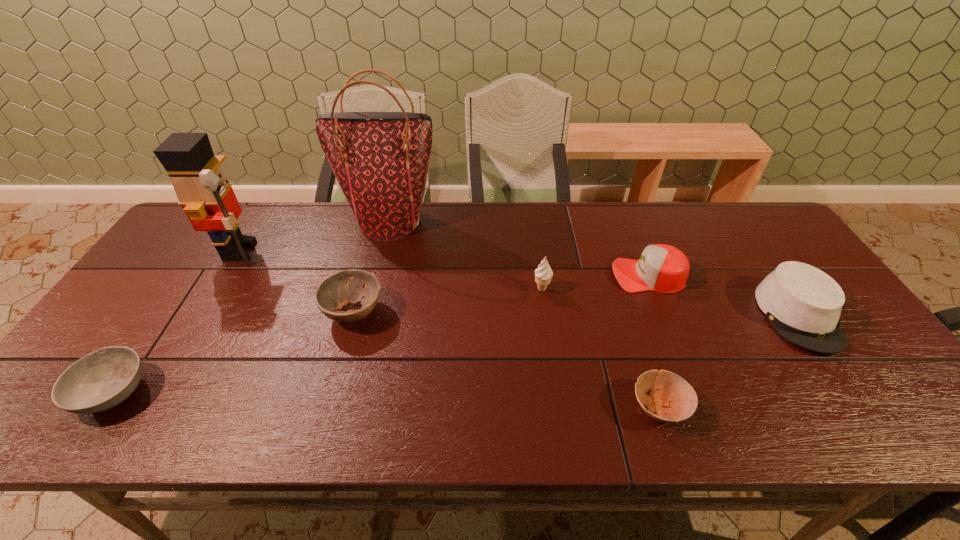
You are a GUI agent. You are given a task and a screenshot of the screen. Output one action in this format:
    pyautogui.click(x=<x>, y=<y>)
    Task: Click on the tallest object
    The height and width of the screenshot is (540, 960).
    Given the screenshot: What is the action you would take?
    [380, 160]

I want to click on nutcracker, so click(x=204, y=192).

Find the location of a particular element. This screenshot has height=540, width=960. the sixth shortest object is located at coordinates (543, 274).

Locate an element on the screen. This screenshot has width=960, height=540. the fourth object from right to left is located at coordinates (543, 274).

You are a GUI agent. You are given a task and a screenshot of the screen. Output one action in this format:
    pyautogui.click(x=<x>, y=<y>)
    Task: Click on the rightmost object
    This screenshot has width=960, height=540.
    Given the screenshot: What is the action you would take?
    pyautogui.click(x=803, y=304)

At what (x,y) coordinates should I click in order to perform the action: click on baseball cap. Please return your answer as a coordinate pair (x, y). Looking at the image, I should click on (663, 268).

Locate an element on the screen. This screenshot has height=540, width=960. the tallest bowl is located at coordinates (336, 292).

The width and height of the screenshot is (960, 540). What are the coordinates of `the second bowl from right to left` in the screenshot? It's located at tap(336, 292).

Locate an element on the screen. This screenshot has width=960, height=540. the leftmost bowl is located at coordinates (104, 378).

Where is `the rightmost bowl`? Image resolution: width=960 pixels, height=540 pixels. the rightmost bowl is located at coordinates (675, 400).